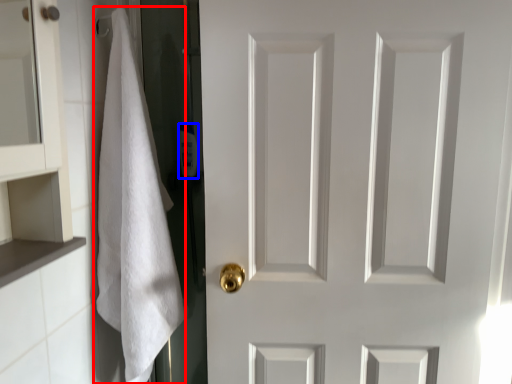
Question: Which point is further to the camera, bath towel (highlighted by a red box) or toiletry (highlighted by a blue box)?

Choices:
 (A) bath towel
 (B) toiletry

Answer: (B)